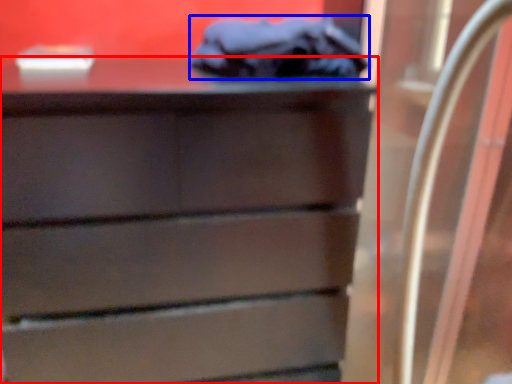
Question: Among these objects, which one is nearest to the camera, chest of drawers (highlighted by a red box) or scrub (highlighted by a blue box)?

Choices:
 (A) chest of drawers
 (B) scrub

Answer: (A)